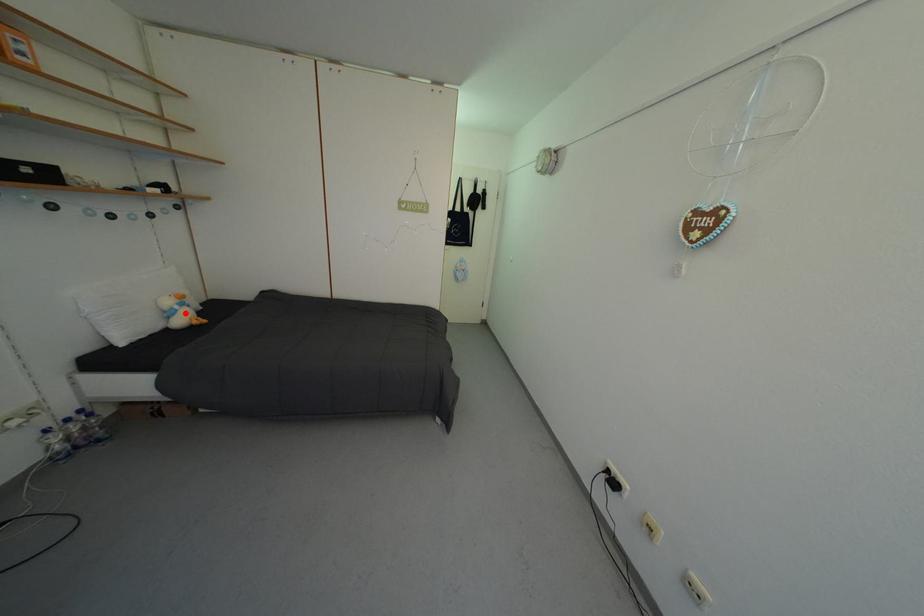
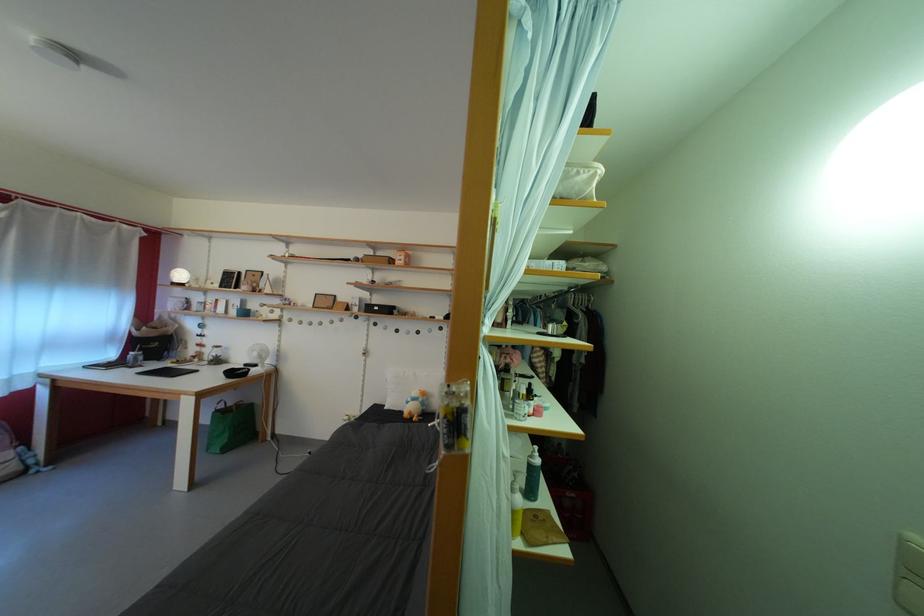
Question: I am providing you with two images of the same scene from different viewpoints. Image1 has a red point marked. In image2, the corresponding 3D location appears at what relative position? Reply with the corresponding letter.

Choices:
 (A) Closer
 (B) Farther

Answer: (B)